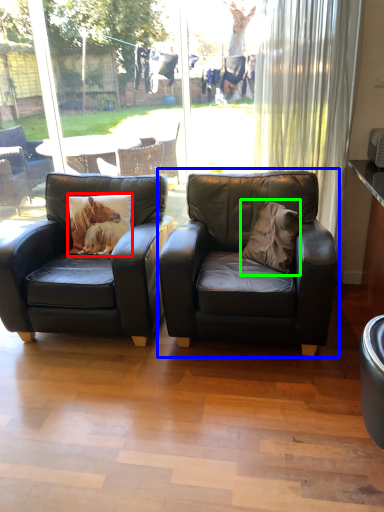
Question: Considering the real-world distances, which object is farthest from pillow (highlighted by a red box)? chair (highlighted by a blue box) or throw pillow (highlighted by a green box)?

Choices:
 (A) chair
 (B) throw pillow

Answer: (B)